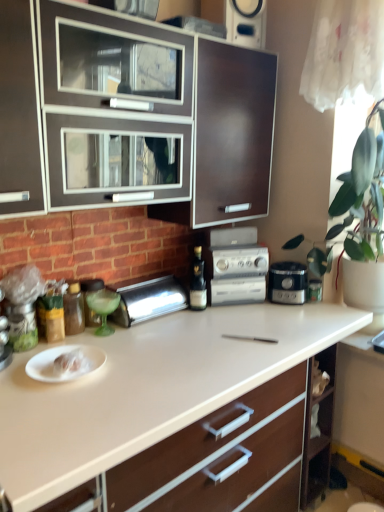
Where is `free space in front of silver metallic stereo at center`? The image size is (384, 512). free space in front of silver metallic stereo at center is located at coordinates (238, 321).